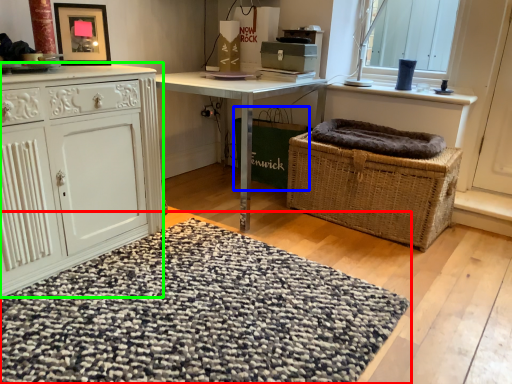
Question: Based on their relative distances, which object is nearer to doormat (highlighted by a red box)? Choose from basket container (highlighted by a blue box) and cabinetry (highlighted by a green box).

Choices:
 (A) basket container
 (B) cabinetry

Answer: (B)